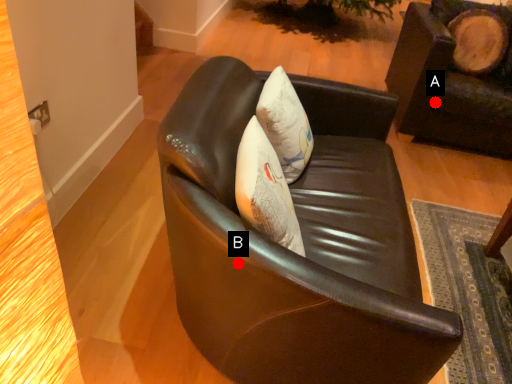
Question: Two points are circled on the image, labeled by A and B beside each circle. Which point is closer to the camera?

Choices:
 (A) A is closer
 (B) B is closer

Answer: (B)